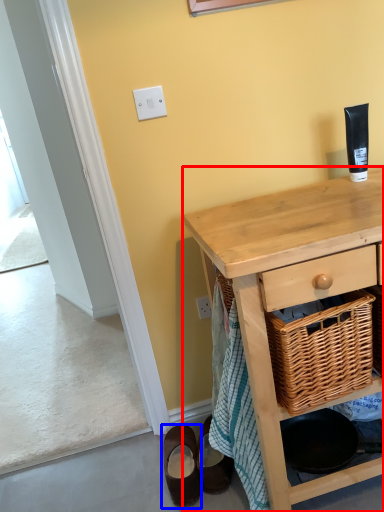
Question: Which point is closer to the camera, desk (highlighted by a red box) or footwear (highlighted by a blue box)?

Choices:
 (A) desk
 (B) footwear

Answer: (A)